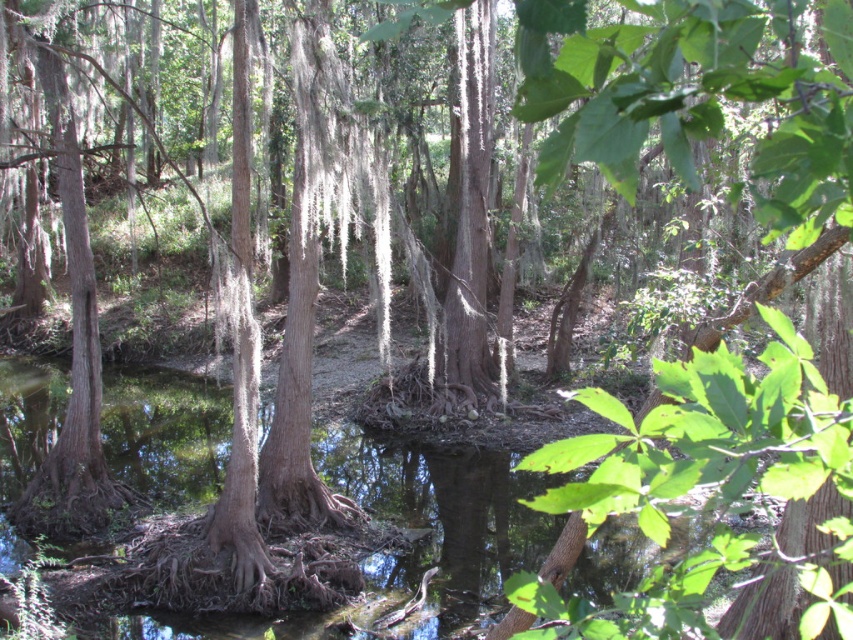
Question: Among these objects, which one is nearest to the camera?

Choices:
 (A) green leafy tree at center
 (B) clear water at center

Answer: (A)

Question: Can you confirm if clear water at center is positioned to the left of green leafy tree at center?

Choices:
 (A) yes
 (B) no

Answer: (A)

Question: Is clear water at center to the right of green leafy tree at center from the viewer's perspective?

Choices:
 (A) yes
 (B) no

Answer: (B)

Question: Which point is closer to the camera?

Choices:
 (A) (599, 54)
 (B) (180, 380)

Answer: (A)

Question: Which point is closer to the camera?

Choices:
 (A) clear water at center
 (B) green leafy tree at center

Answer: (B)

Question: Where is clear water at center located in relation to green leafy tree at center in the image?

Choices:
 (A) right
 (B) left

Answer: (B)